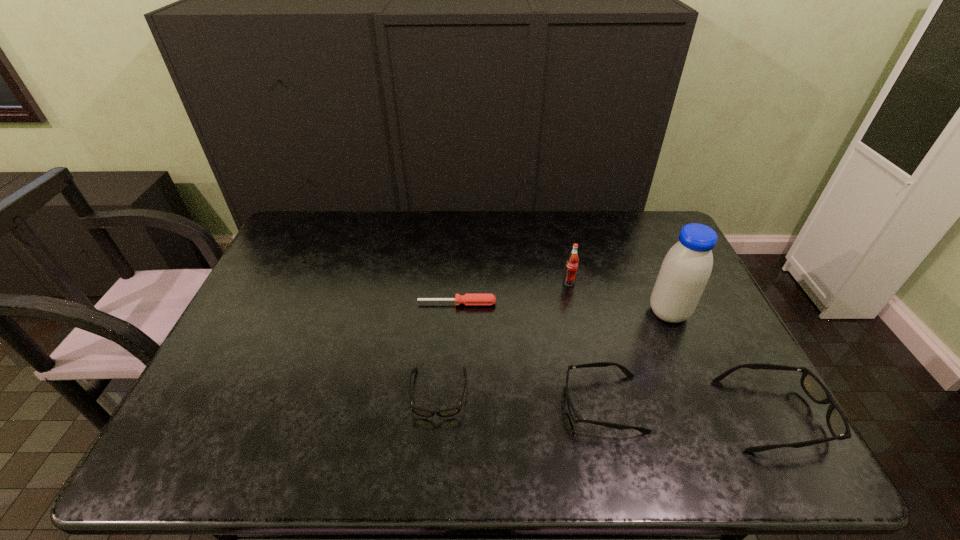
The height and width of the screenshot is (540, 960). What are the coordinates of `the shortest spectacles` in the screenshot? It's located at (449, 412).

Find the location of a particular element. This screenshot has height=540, width=960. the leftmost spectacles is located at coordinates (449, 412).

This screenshot has height=540, width=960. I want to click on the fourth tallest object, so click(x=573, y=414).

Identify the location of the second spectacles from left to right. (573, 414).

This screenshot has height=540, width=960. In order to click on the tallest spectacles in this screenshot , I will do `click(838, 426)`.

This screenshot has width=960, height=540. Find the location of `the rightmost spectacles`. the rightmost spectacles is located at coordinates (838, 426).

The height and width of the screenshot is (540, 960). Find the location of `the tallest object`. the tallest object is located at coordinates (686, 268).

The width and height of the screenshot is (960, 540). What are the coordinates of `the fifth shortest object` in the screenshot? It's located at (572, 262).

Image resolution: width=960 pixels, height=540 pixels. What are the coordinates of `the farthest object` in the screenshot? It's located at (572, 262).

Where is `the shortest object`? the shortest object is located at coordinates (468, 299).